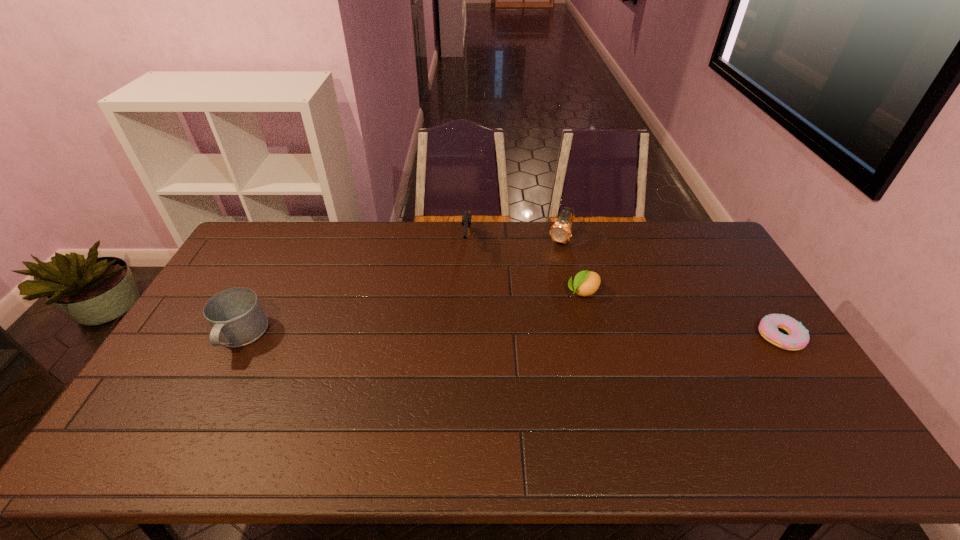
You are a GUI agent. You are given a task and a screenshot of the screen. Output one action in this format:
    pyautogui.click(x=<x>, y=<y>)
    Task: Click on the mug
    This screenshot has height=540, width=960.
    Given the screenshot: What is the action you would take?
    pyautogui.click(x=236, y=317)

The height and width of the screenshot is (540, 960). Identify the location of the shortest object. (798, 338).

The height and width of the screenshot is (540, 960). In order to click on doughnut in this screenshot , I will do `click(798, 338)`.

Image resolution: width=960 pixels, height=540 pixels. I want to click on lemon, so click(x=586, y=283).

Locate an element on the screen. the third farthest object is located at coordinates (586, 283).

Identify the location of watch. (560, 231).

At what (x,y) coordinates should I click in order to perform the action: click on the fourth object from right to left. Please return your answer as a coordinate pair (x, y). This screenshot has width=960, height=540. Looking at the image, I should click on (466, 217).

At what (x,y) coordinates should I click in order to perform the action: click on free space located 0.150m on the side of the mug with the handle. Please return your answer as a coordinate pair (x, y). The image size is (960, 540). Looking at the image, I should click on (202, 410).

What are the coordinates of `free spot located on the left of the doughnut` in the screenshot? It's located at (638, 336).

You are a GUI agent. You are given a task and a screenshot of the screen. Output one action in this format:
    pyautogui.click(x=<x>, y=<y>)
    Task: Click on the free space located 0.370m with leaves positioned above the third farthest object
    The width and height of the screenshot is (960, 540).
    Given the screenshot: What is the action you would take?
    pyautogui.click(x=488, y=361)